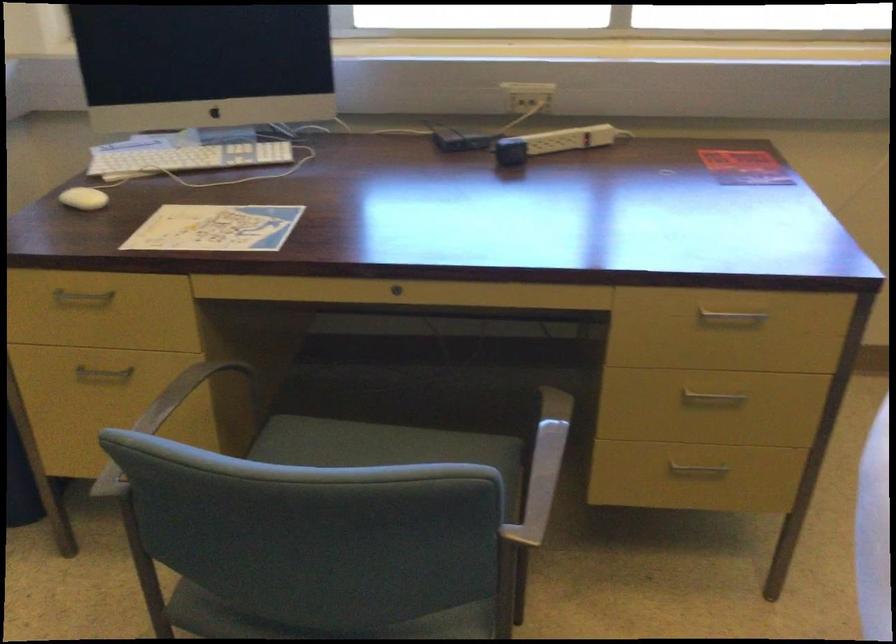
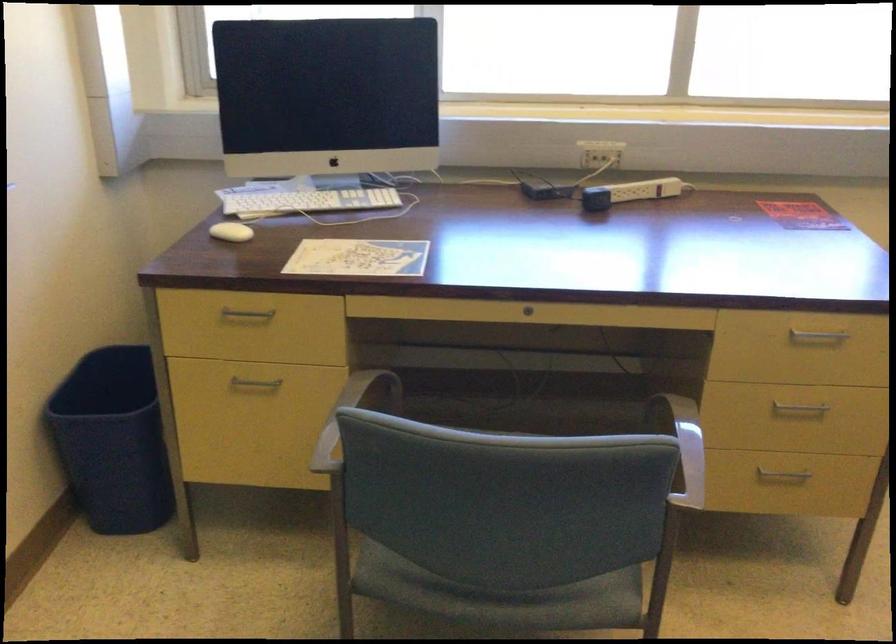
What movement of the cameraman would produce the second image?

The cameraman walked toward left, backward.